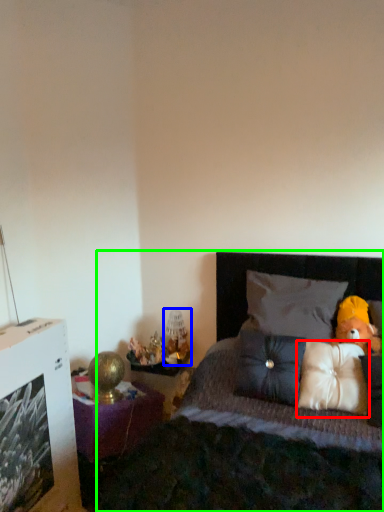
Question: Based on their relative distances, which object is farther from pillow (highlighted by a red box)? Choose from table lamp (highlighted by a blue box) and bed (highlighted by a green box).

Choices:
 (A) table lamp
 (B) bed

Answer: (A)